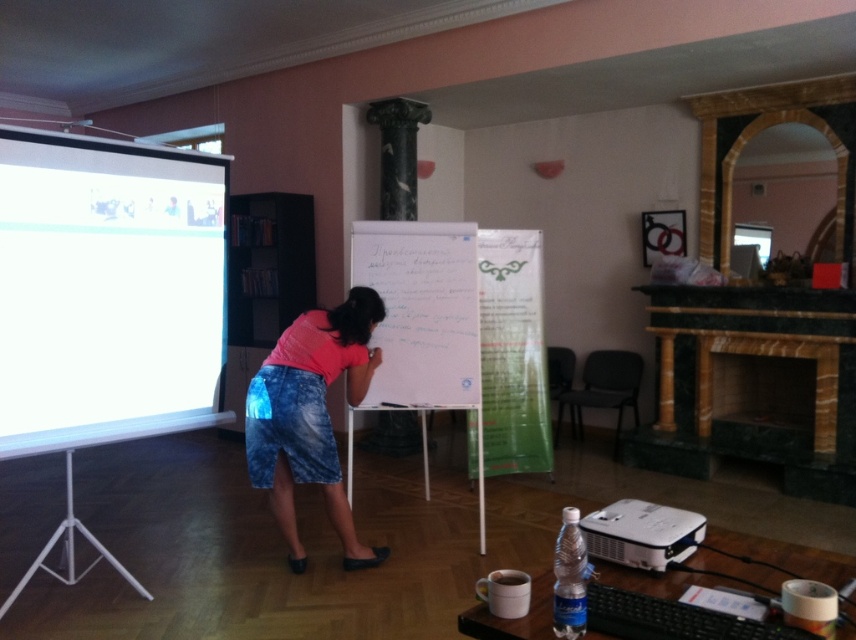
Is white matte projection screen at left to the left of white plastic projector at lower right from the viewer's perspective?

Correct, you'll find white matte projection screen at left to the left of white plastic projector at lower right.

Does white matte projection screen at left lie in front of white plastic projector at lower right?

No.

Which is in front, point (81, 324) or point (664, 550)?

Point (664, 550)

Where is `white matte projection screen at left`? white matte projection screen at left is located at coordinates click(107, 291).

Who is more forward, (330, 342) or (704, 532)?

Point (704, 532) is more forward.

Between pink fabric skirt at center and white plastic projector at lower right, which one is positioned higher?

Positioned higher is pink fabric skirt at center.

At what (x,y) coordinates should I click in order to perform the action: click on pink fabric skirt at center. Please return your answer as a coordinate pair (x, y). Looking at the image, I should click on (311, 416).

Is whiteboard at center thinner than pink fabric skirt at center?

Incorrect, whiteboard at center's width is not less than pink fabric skirt at center's.

Who is more forward, [431,342] or [305,563]?

Positioned in front is point [305,563].

Who is more distant from viewer, (414, 326) or (336, 522)?

Point (414, 326)

Locate an element on the screen. whiteboard at center is located at coordinates (423, 321).